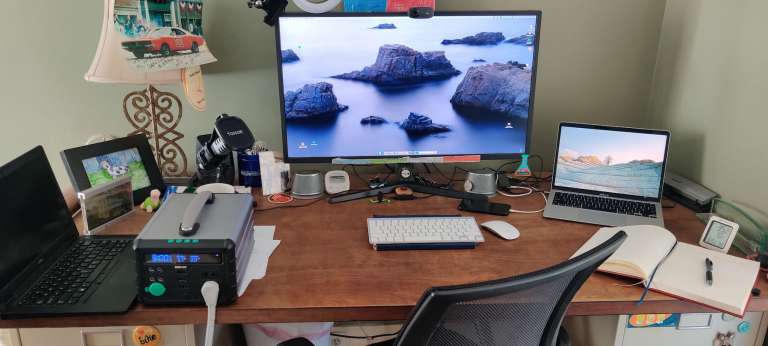
At what (x,y) coordinates should I click in order to perform the action: click on left speaker. Please return your answer as a coordinate pair (x, y). This screenshot has height=346, width=768. Looking at the image, I should click on (303, 185).